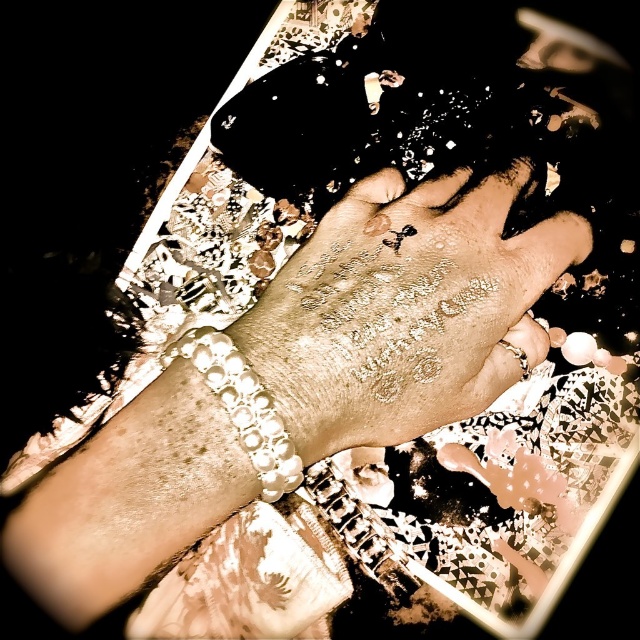
You are a photographer adjusting the focus on your camera. You need to focus on both the henna designs on the hand and the patterned surface below it. The points representing these elements are point (x=438, y=310) and point (x=227, y=408) respectively. Which point should you focus on first to ensure the closest element is sharp?

Point (x=438, y=310) is further to the viewer than point (x=227, y=408). Therefore, to ensure the closest element is sharp, you should focus on point (x=227, y=408) first.

You are a photographer trying to capture the gold glittery hand at center. The camera you are using has a focal length of 50mm and requires the subject to be at least 40 centimeters away to avoid blurring. Based on the scene description, will you be able to take a clear photo without moving the hand?

The gold glittery hand at center is 36.07 centimeters away from the camera, which is closer than the required 40 centimeters. Therefore, you will not be able to take a clear photo without moving the hand closer to meet the minimum distance requirement.